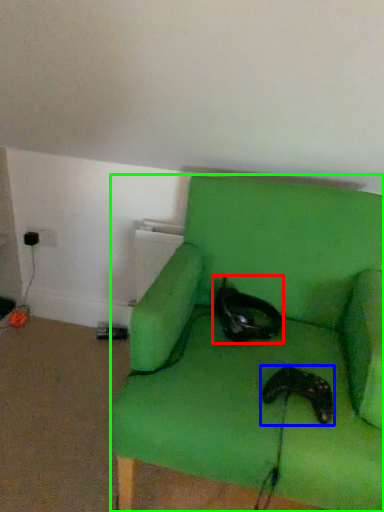
Question: Which is farther away from cat (highlighted by a red box)? footwear (highlighted by a blue box) or chair (highlighted by a green box)?

Choices:
 (A) footwear
 (B) chair

Answer: (A)